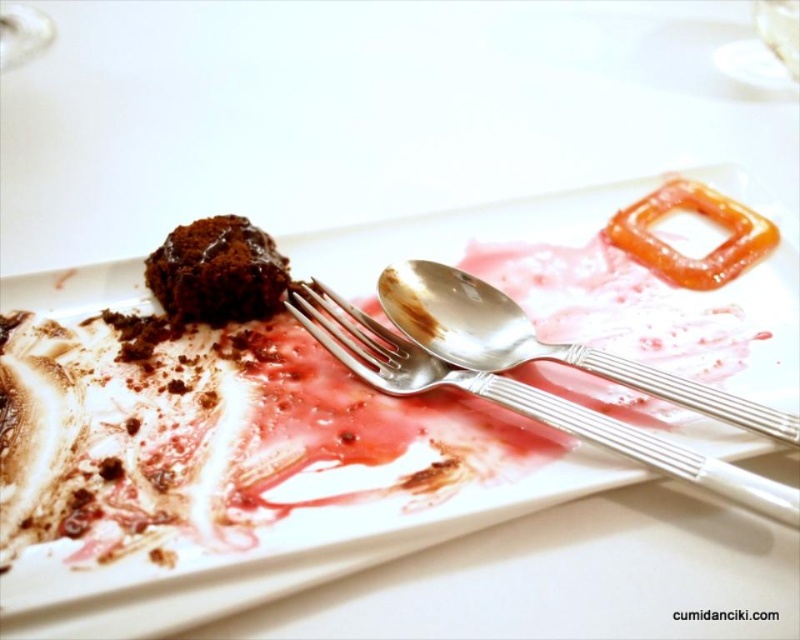
You are looking at the dessert plate and notice two points marked on the edge. The first point is at coordinates point (750, 324) and the second is at point (746, 220). Which of these two points is closer to you as you view the plate?

Point (750, 324) is closer to the camera than point (746, 220).

In the scene shown: You are a food critic who needs to taste the chocolate matte cake at upper left. The silver polished fork at center is in your way. Can you move the fork without touching the remaining dessert?

The silver polished fork at center is closer to the viewer than the chocolate matte cake at upper left, so you can move the fork without disturbing the dessert.

You are a food stylist trying to arrange a dessert photo shoot. You have a white glossy plate at center and a chocolate matte cake at upper left. The client wants the cake to be positioned exactly 10 inches away from the plate. Based on the current setup, is the cake positioned correctly?

The white glossy plate at center and chocolate matte cake at upper left are 9.87 inches apart from each other, so the cake is slightly closer than the required 10 inches and needs to be moved further away by 0.13 inches to meet the client specifications.